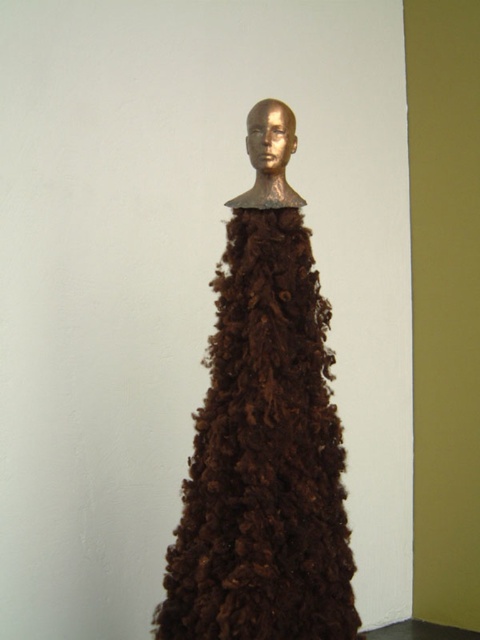
Does brown fluffy dress at center appear on the left side of gold metallic head at center?

Indeed, brown fluffy dress at center is positioned on the left side of gold metallic head at center.

Which is behind, point (283, 275) or point (275, 145)?

Positioned behind is point (283, 275).

What do you see at coordinates (264, 449) in the screenshot? This screenshot has height=640, width=480. I see `brown fluffy dress at center` at bounding box center [264, 449].

Where is `brown fluffy dress at center`? This screenshot has height=640, width=480. brown fluffy dress at center is located at coordinates click(x=264, y=449).